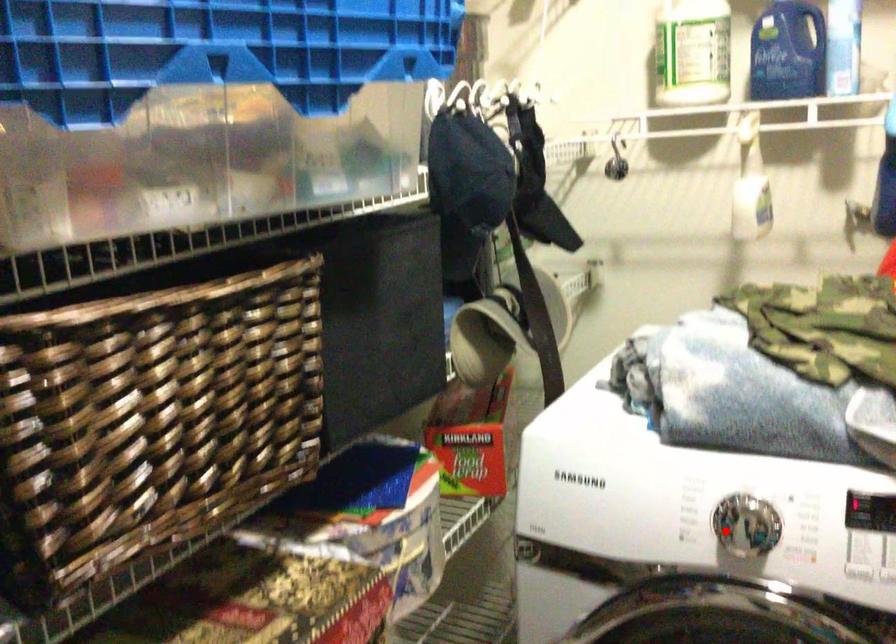
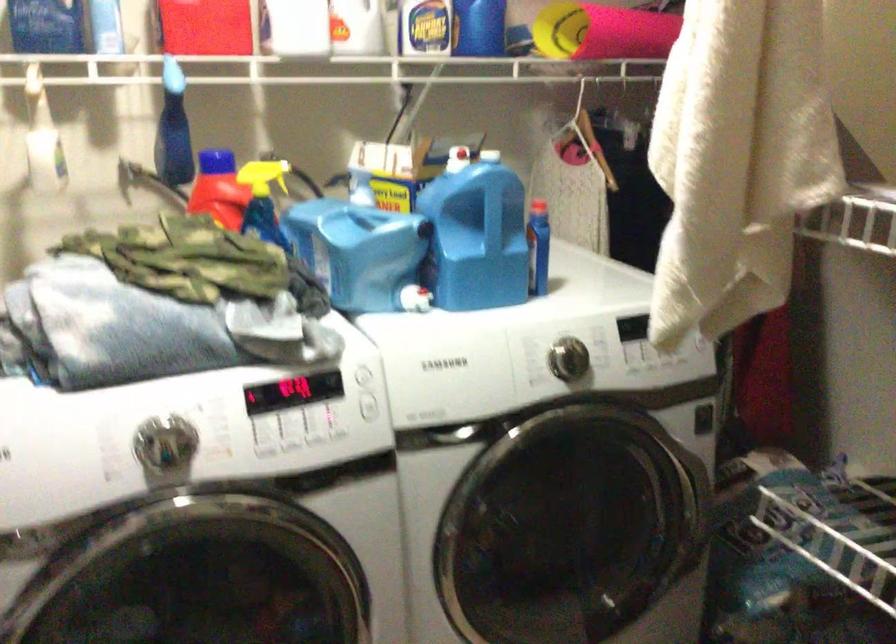
Find the pixel in the second image that matches the highlighted location in the first image.

(166, 448)